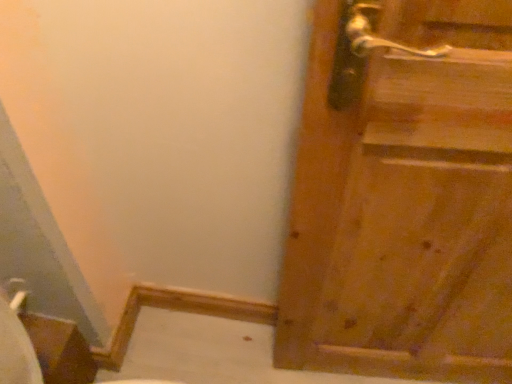
Identify the location of wooden door at right. [403, 195].

This screenshot has width=512, height=384. What do you see at coordinates (403, 195) in the screenshot?
I see `wooden door at right` at bounding box center [403, 195].

Where is `wooden door at right`? wooden door at right is located at coordinates [403, 195].